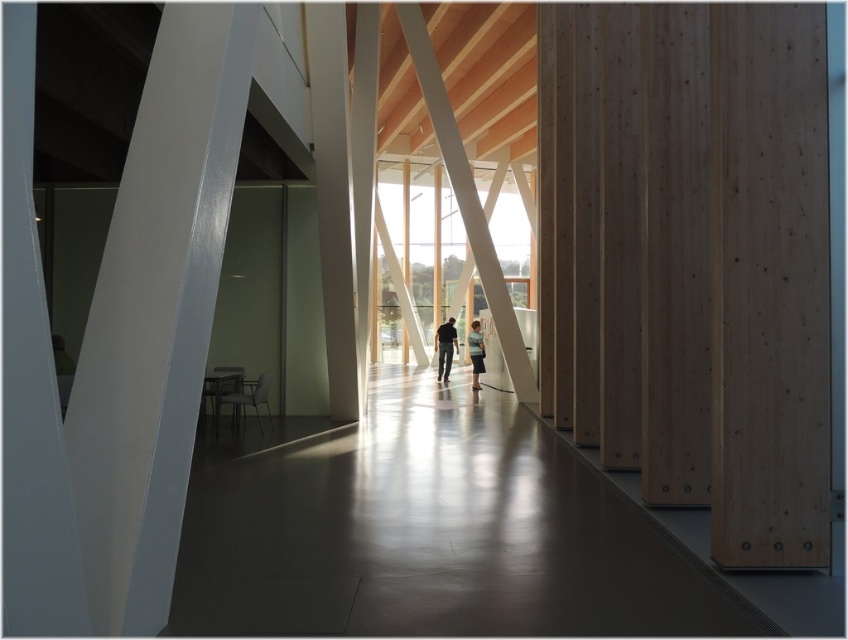
Which is below, light brown wooden beam at center or light blue denim jacket at center?

light brown wooden beam at center is lower down.

Is light brown wooden beam at center wider than light blue denim jacket at center?

Indeed, light brown wooden beam at center has a greater width compared to light blue denim jacket at center.

Is point (505, 348) positioned behind point (476, 342)?

No, (505, 348) is closer to viewer.

What are the coordinates of `light brown wooden beam at center` in the screenshot? It's located at (467, 200).

At what (x,y) coordinates should I click in order to perform the action: click on light brown wooden beam at center. Please return your answer as a coordinate pair (x, y). The image size is (848, 640). Looking at the image, I should click on (467, 200).

What do you see at coordinates (467, 200) in the screenshot? The width and height of the screenshot is (848, 640). I see `light brown wooden beam at center` at bounding box center [467, 200].

Where is `light brown wooden beam at center`? light brown wooden beam at center is located at coordinates (467, 200).

Does white glossy beam at left lie in front of light blue denim jacket at center?

Yes.

Is white glossy beam at left shorter than light blue denim jacket at center?

No, white glossy beam at left is not shorter than light blue denim jacket at center.

Who is more forward, (177,54) or (478,358)?

Point (177,54) is more forward.

Where is `white glossy beam at left`? white glossy beam at left is located at coordinates (155, 314).